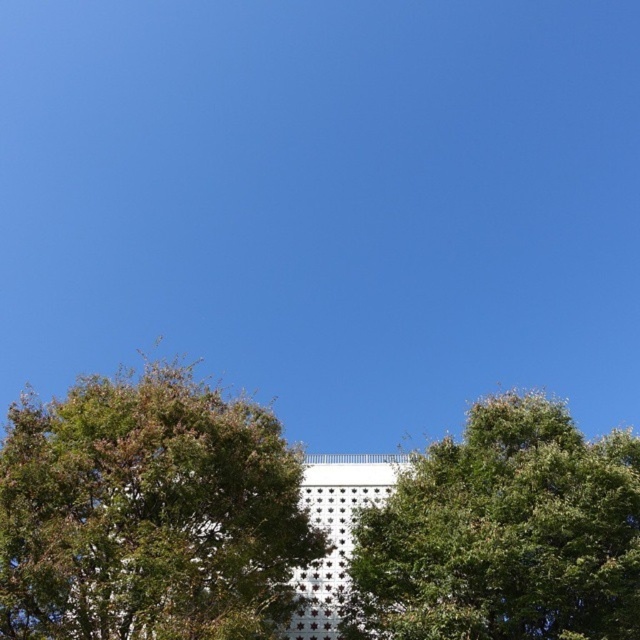
Looking at this image, can you confirm if green leafy tree at center is bigger than green leafy tree at upper center?

Yes.

Which is more to the right, green leafy tree at center or green leafy tree at upper center?

green leafy tree at upper center

The height and width of the screenshot is (640, 640). In order to click on green leafy tree at center in this screenshot , I will do `click(148, 513)`.